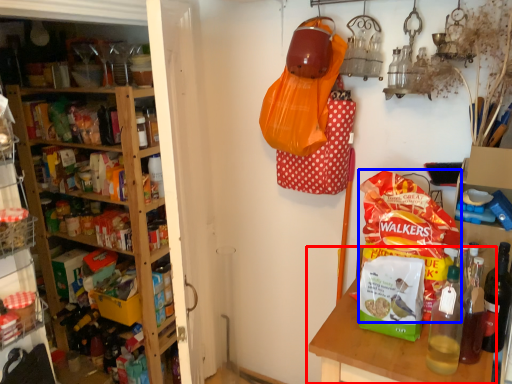
Question: Which object appears closest to the camera in this image, table (highlighted by a red box) or snack (highlighted by a blue box)?

Choices:
 (A) table
 (B) snack

Answer: (A)